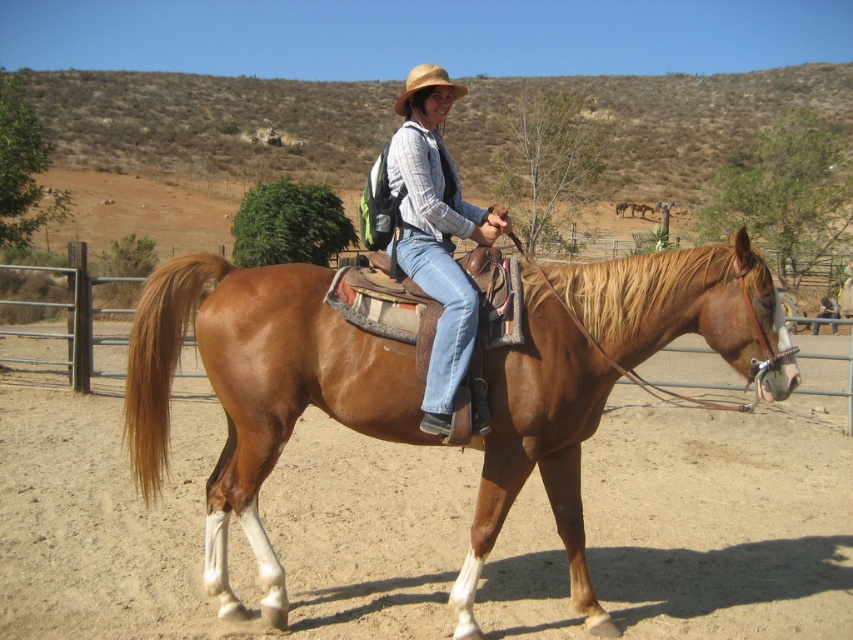
Question: Which point is closer to the camera?

Choices:
 (A) straw hat at upper center
 (B) brown leather saddle at center
 (C) matte brown leather saddle at center

Answer: (C)

Question: Does brown leather saddle at center have a greater width compared to matte brown leather saddle at center?

Choices:
 (A) no
 (B) yes

Answer: (B)

Question: Which of the following is the closest to the observer?

Choices:
 (A) straw hat at upper center
 (B) brown leather saddle at center

Answer: (B)

Question: Which object is the closest to the straw hat at upper center?

Choices:
 (A) brown leather saddle at center
 (B) matte brown leather saddle at center

Answer: (A)

Question: Can you confirm if brown leather saddle at center is wider than matte brown leather saddle at center?

Choices:
 (A) no
 (B) yes

Answer: (B)

Question: Does brown leather saddle at center appear over straw hat at upper center?

Choices:
 (A) yes
 (B) no

Answer: (B)